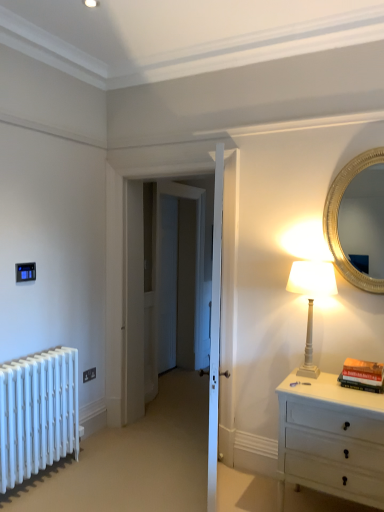
Find the location of a particular element. vacant space situated on the left part of hardcover book at right is located at coordinates (336, 385).